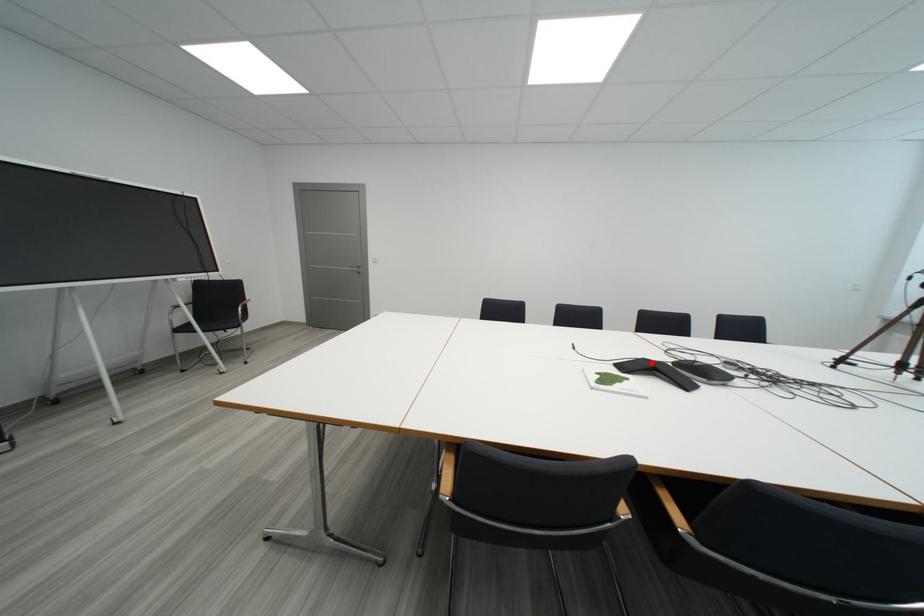
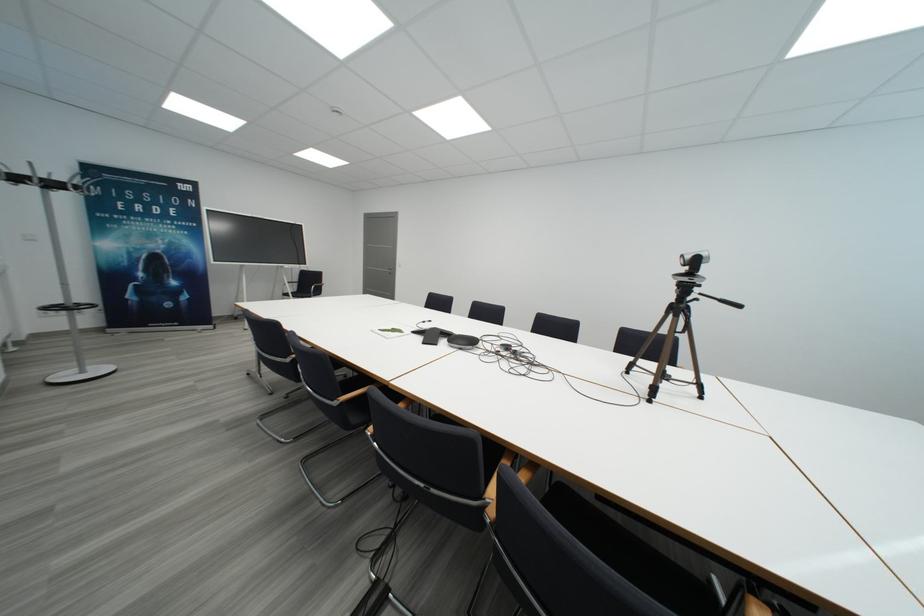
Locate, in the second image, the point that corresponds to the highlighted location in the first image.

(442, 331)